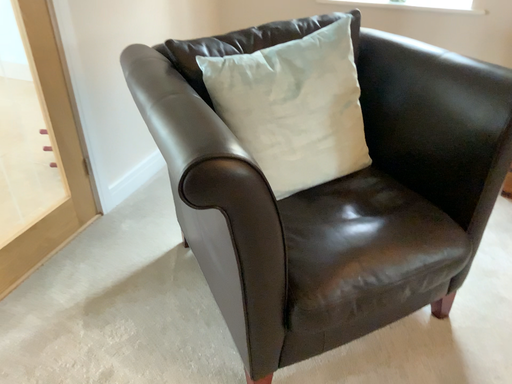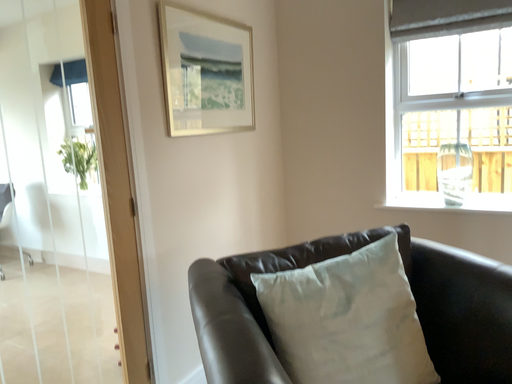
Question: Which way did the camera rotate in the video?

Choices:
 (A) rotated right
 (B) rotated left

Answer: (B)